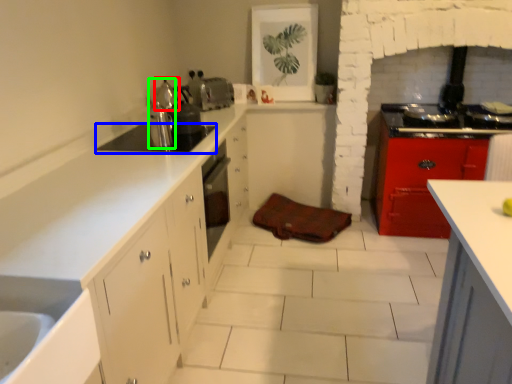
Question: Considering the real-world distances, which object is farthest from tea pot (highlighted by a red box)? appliance (highlighted by a blue box) or kitchen appliance (highlighted by a green box)?

Choices:
 (A) appliance
 (B) kitchen appliance

Answer: (A)